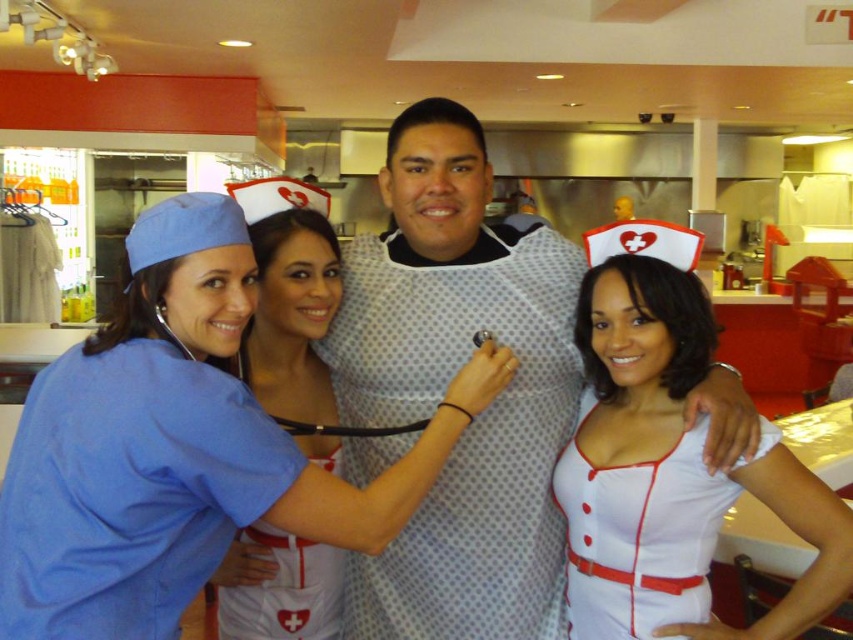
Question: Which point is farther to the camera?

Choices:
 (A) (585, 317)
 (B) (171, 204)
 (C) (593, 550)
 (D) (308, 580)

Answer: (A)

Question: Among these objects, which one is farthest from the camera?

Choices:
 (A) white satin apron at center
 (B) blue fabric nurse uniform at center
 (C) white satin nurse uniform at center

Answer: (A)

Question: Is white satin apron at center behind white fabric apron at center?

Choices:
 (A) no
 (B) yes

Answer: (A)

Question: Does white satin nurse uniform at center come in front of white fabric apron at center?

Choices:
 (A) no
 (B) yes

Answer: (B)

Question: Which point appears farthest from the camera in this image?

Choices:
 (A) (331, 576)
 (B) (676, 508)

Answer: (A)

Question: Does blue fabric nurse uniform at center appear on the right side of white dotted shirt at center?

Choices:
 (A) no
 (B) yes

Answer: (A)